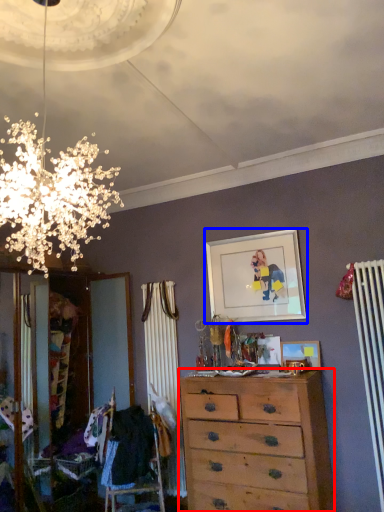
Question: Which object is further to the camera taking this photo, chest of drawers (highlighted by a red box) or picture frame (highlighted by a blue box)?

Choices:
 (A) chest of drawers
 (B) picture frame

Answer: (B)